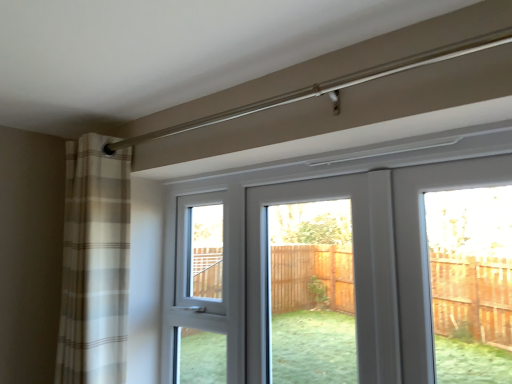
Question: Should I look upward or downward to see plaid fabric curtain at left?

Choices:
 (A) down
 (B) up

Answer: (A)

Question: Does white plastic screen door at center have a lesser height compared to white glossy door at center?

Choices:
 (A) yes
 (B) no

Answer: (B)

Question: Is white plastic screen door at center looking in the opposite direction of white glossy door at center?

Choices:
 (A) yes
 (B) no

Answer: (A)

Question: Does white plastic screen door at center have a greater height compared to white glossy door at center?

Choices:
 (A) no
 (B) yes

Answer: (B)

Question: Can you confirm if white plastic screen door at center is smaller than white glossy door at center?

Choices:
 (A) no
 (B) yes

Answer: (B)

Question: From a real-world perspective, does white plastic screen door at center stand above white glossy door at center?

Choices:
 (A) no
 (B) yes

Answer: (B)

Question: Does white plastic screen door at center appear on the left side of white glossy door at center?

Choices:
 (A) yes
 (B) no

Answer: (B)

Question: Is white plastic screen door at center thinner than plaid fabric curtain at left?

Choices:
 (A) no
 (B) yes

Answer: (B)

Question: Does white plastic screen door at center have a greater height compared to plaid fabric curtain at left?

Choices:
 (A) no
 (B) yes

Answer: (A)

Question: Would you say white plastic screen door at center is outside plaid fabric curtain at left?

Choices:
 (A) no
 (B) yes

Answer: (B)

Question: Could you tell me if white plastic screen door at center is turned towards plaid fabric curtain at left?

Choices:
 (A) no
 (B) yes

Answer: (A)

Question: Can you confirm if white plastic screen door at center is bigger than plaid fabric curtain at left?

Choices:
 (A) no
 (B) yes

Answer: (A)

Question: Is white plastic screen door at center further to the viewer compared to plaid fabric curtain at left?

Choices:
 (A) yes
 (B) no

Answer: (B)

Question: Considering the relative sizes of white glossy door at center and plaid fabric curtain at left in the image provided, is white glossy door at center shorter than plaid fabric curtain at left?

Choices:
 (A) yes
 (B) no

Answer: (A)